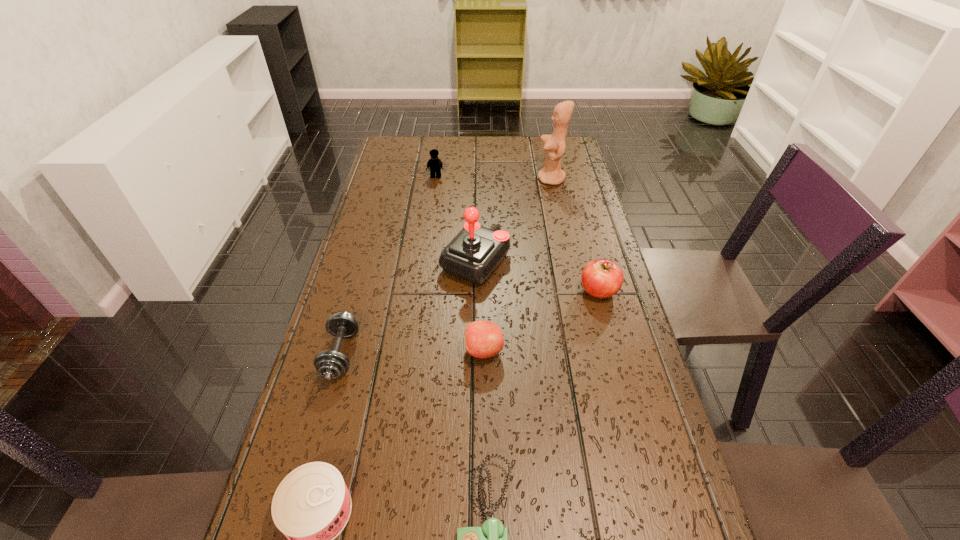
The width and height of the screenshot is (960, 540). I want to click on free space located 0.240m on the front-facing side of the tallest object, so click(470, 179).

You are a GUI agent. You are given a task and a screenshot of the screen. Output one action in this format:
    pyautogui.click(x=<x>, y=<y>)
    Task: Click on the vacant space located 0.200m on the front of the joystick
    Image resolution: width=960 pixels, height=540 pixels.
    Given the screenshot: What is the action you would take?
    pyautogui.click(x=474, y=350)

At what (x,y) coordinates should I click in order to perform the action: click on vacant space situated 0.220m on the front-facing side of the sixth object from right to left. Please return your answer as a coordinate pair (x, y). Looking at the image, I should click on (430, 217).

Identify the location of free space located 0.080m on the front of the taller apple. (609, 328).

The height and width of the screenshot is (540, 960). Identify the location of free space located on the back of the nearer apple. (484, 284).

Identify the location of vacant space located on the front of the dumbbell. The width and height of the screenshot is (960, 540). (291, 538).

Locate an element on the screen. The width and height of the screenshot is (960, 540). object located in the left edge section of the desktop is located at coordinates (329, 364).

Where is `figurine located in the right edge section of the desktop`? figurine located in the right edge section of the desktop is located at coordinates (554, 145).

Locate an element on the screen. apple present at the right edge is located at coordinates (601, 278).

This screenshot has height=540, width=960. Identify the location of vacant region at the far edge. (468, 140).